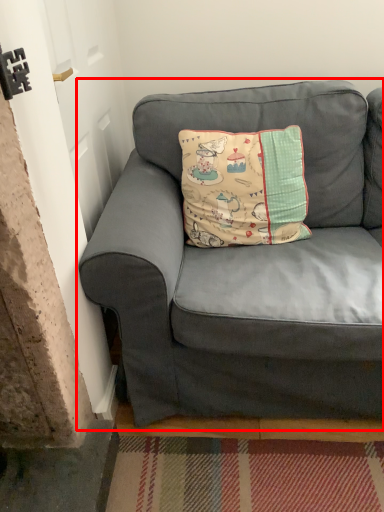
Question: Considering the relative positions of studio couch (annotated by the red box) and pillow in the image provided, where is studio couch (annotated by the red box) located with respect to the staircase?

Choices:
 (A) right
 (B) left

Answer: (A)